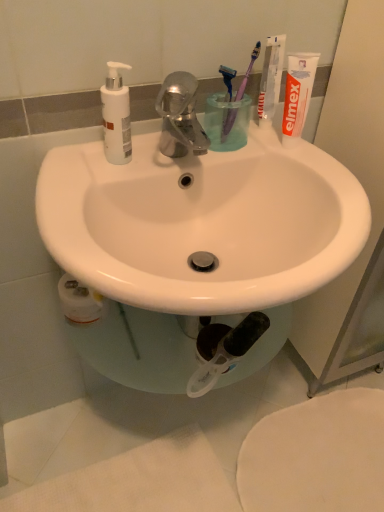
Find the location of a particular element. This screenshot has width=384, height=512. free point below white glossy sink at center (from a real-world perspective) is located at coordinates (180, 436).